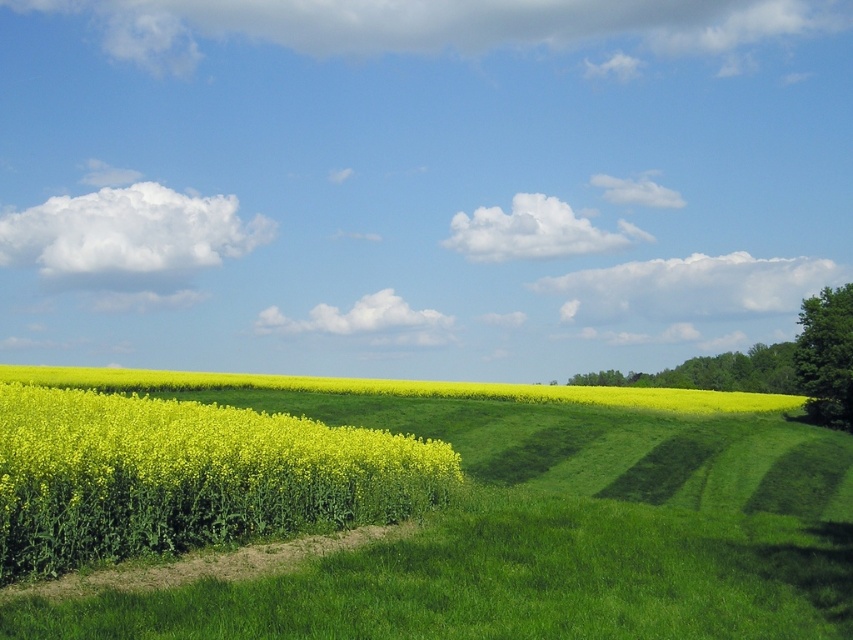
Question: Which of these objects is positioned farthest from the green leafy tree at upper right?

Choices:
 (A) green leafy tree at right
 (B) yellow-green grass at left
 (C) green grassy field at center

Answer: (B)

Question: Can you confirm if green grassy field at center is thinner than green leafy tree at right?

Choices:
 (A) no
 (B) yes

Answer: (A)

Question: Is yellow-green grass at left wider than green leafy tree at right?

Choices:
 (A) yes
 (B) no

Answer: (A)

Question: Estimate the real-world distances between objects in this image. Which object is closer to the yellow-green grass at left?

Choices:
 (A) green grassy field at center
 (B) green leafy tree at right

Answer: (A)

Question: Estimate the real-world distances between objects in this image. Which object is closer to the green leafy tree at upper right?

Choices:
 (A) green leafy tree at right
 (B) yellow-green grass at left
 (C) green grassy field at center

Answer: (A)

Question: Does green leafy tree at right have a larger size compared to green leafy tree at upper right?

Choices:
 (A) yes
 (B) no

Answer: (B)